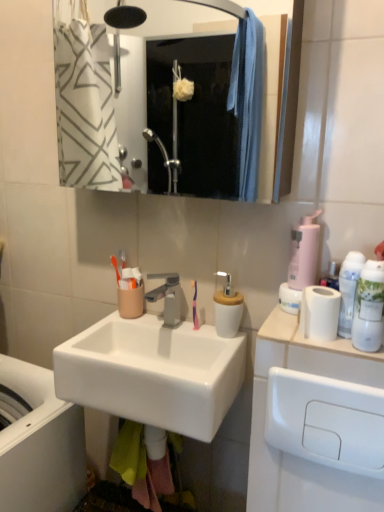
This screenshot has width=384, height=512. Identify the location of free location to the left of purple plastic toothbrush at center. (148, 329).